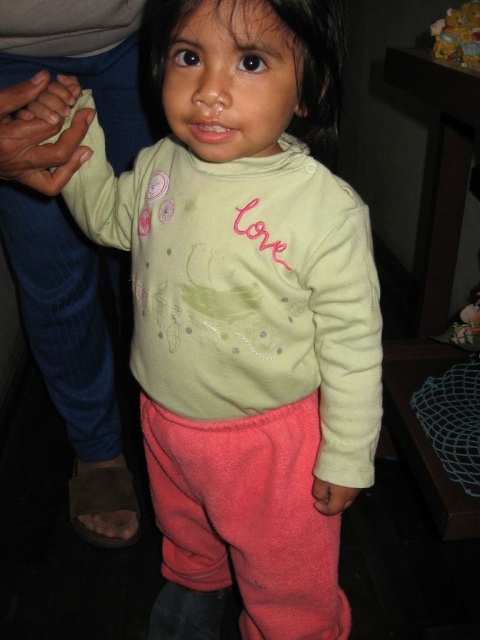
Question: Is matte yellow hand at left below pink fabric hand at lower center?

Choices:
 (A) yes
 (B) no

Answer: (B)

Question: Which point is farther to the camera?

Choices:
 (A) (335, 508)
 (B) (85, 108)

Answer: (A)

Question: Is matte yellow hand at left closer to camera compared to pink fabric hand at lower center?

Choices:
 (A) yes
 (B) no

Answer: (A)

Question: In this image, where is matte yellow hand at left located relative to pink fabric hand at lower center?

Choices:
 (A) below
 (B) above

Answer: (B)

Question: Which point appears closest to the camera in this image?

Choices:
 (A) (36, 84)
 (B) (334, 496)

Answer: (A)

Question: Which object appears closest to the camera in this image?

Choices:
 (A) matte yellow hand at left
 (B) pink fabric hand at lower center

Answer: (A)